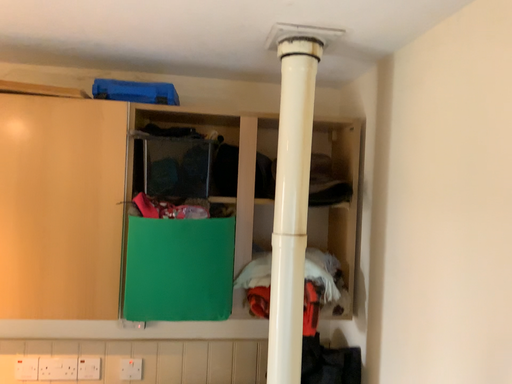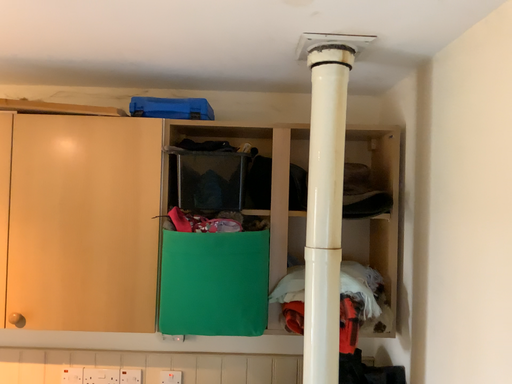
Question: Which way did the camera rotate in the video?

Choices:
 (A) rotated left
 (B) rotated right

Answer: (A)